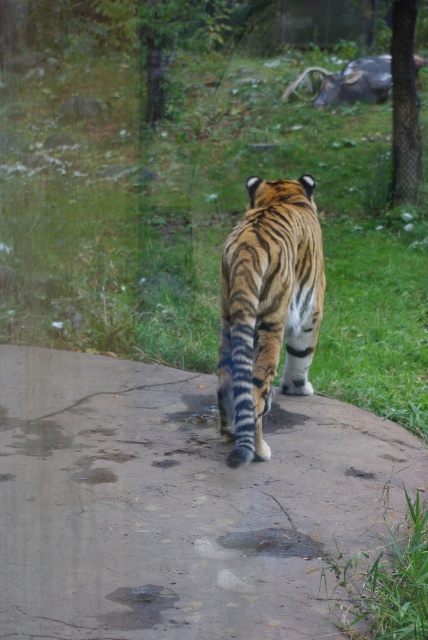
Question: Among these points, which one is nearest to the camera?

Choices:
 (A) pos(335,99)
 (B) pos(178,138)
 (C) pos(306,252)

Answer: (C)

Question: Which of these objects is positioned farthest from the gray metallic bull at upper center?

Choices:
 (A) green grass at center
 (B) orange striped tiger at center
 (C) concrete wet pavement at center

Answer: (C)

Question: Is orange striped tiger at center wider than gray metallic bull at upper center?

Choices:
 (A) no
 (B) yes

Answer: (A)

Question: Is green grass at center above orange striped tiger at center?

Choices:
 (A) yes
 (B) no

Answer: (A)

Question: Estimate the real-world distances between objects in this image. Which object is closer to the orange striped tiger at center?

Choices:
 (A) green grass at center
 (B) concrete wet pavement at center

Answer: (B)

Question: Is concrete wet pavement at center in front of gray metallic bull at upper center?

Choices:
 (A) no
 (B) yes

Answer: (B)